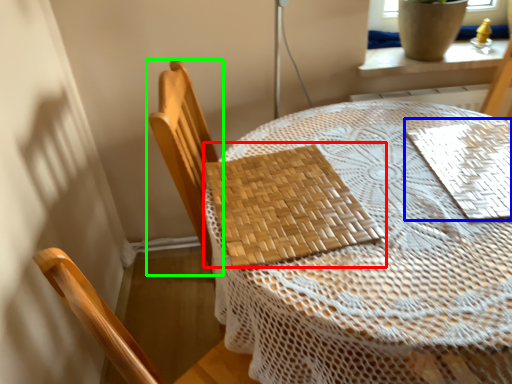
Question: Considering the real-world distances, which object is farthest from mat (highlighted by a red box)? mat (highlighted by a blue box) or chair (highlighted by a green box)?

Choices:
 (A) mat
 (B) chair

Answer: (A)